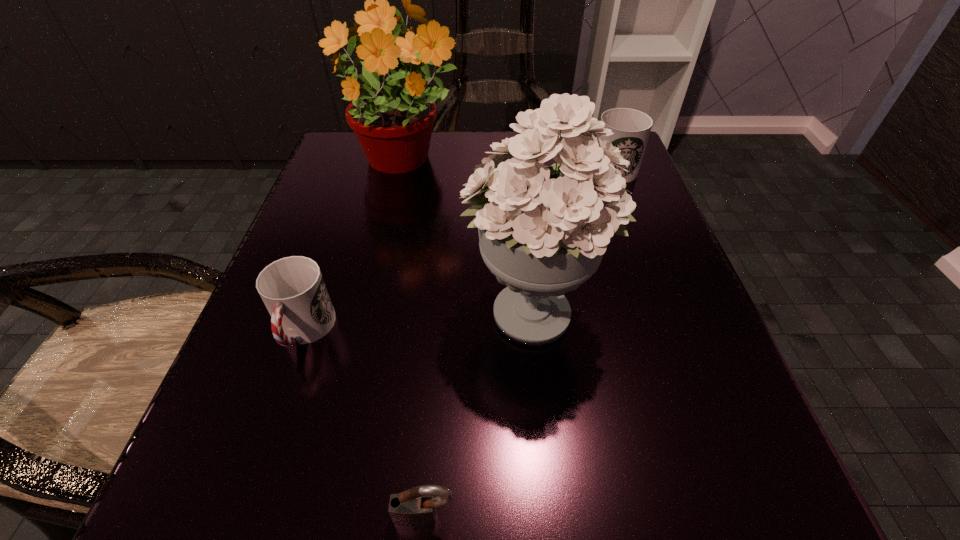
At what (x,y) coordinates should I click in order to perform the action: click on flowerpot. Please return your answer as a coordinate pair (x, y). Looking at the image, I should click on (393, 125).

Image resolution: width=960 pixels, height=540 pixels. Identify the location of bouquet. (543, 230).

The width and height of the screenshot is (960, 540). What are the coordinates of `the taller cup` in the screenshot? It's located at (631, 128).

Identify the location of the third tallest object. This screenshot has width=960, height=540. (631, 128).

Locate an element on the screen. The image size is (960, 540). the nearer cup is located at coordinates (293, 290).

At what (x,y) coordinates should I click in order to perform the action: click on the shorter cup. Please return your answer as a coordinate pair (x, y). The width and height of the screenshot is (960, 540). Looking at the image, I should click on (293, 290).

At what (x,y) coordinates should I click in order to perform the action: click on padlock. Please return your answer as a coordinate pair (x, y). This screenshot has width=960, height=540. Looking at the image, I should click on (416, 507).

What are the coordinates of `free space located on the right of the flowerpot` in the screenshot? It's located at (516, 163).

Locate an element on the screen. This screenshot has height=540, width=960. vacant region located on the back of the bouquet is located at coordinates (515, 146).

The width and height of the screenshot is (960, 540). In order to click on vacant space located 0.230m on the side of the rightmost object where the handle is located in this screenshot , I will do `click(460, 170)`.